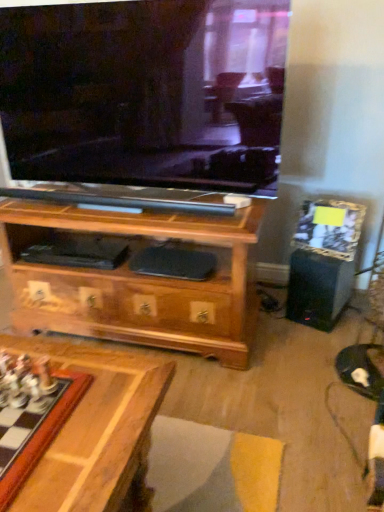
Question: Does wooden chessboard at lower left turn towards black plastic speaker at right?

Choices:
 (A) yes
 (B) no

Answer: (B)

Question: Is wooden chessboard at lower left shorter than black plastic speaker at right?

Choices:
 (A) yes
 (B) no

Answer: (A)

Question: Is wooden chessboard at lower left turned away from black plastic speaker at right?

Choices:
 (A) yes
 (B) no

Answer: (B)

Question: From the image's perspective, would you say wooden chessboard at lower left is shown under black plastic speaker at right?

Choices:
 (A) no
 (B) yes

Answer: (B)

Question: Is wooden chessboard at lower left taller than black plastic speaker at right?

Choices:
 (A) no
 (B) yes

Answer: (A)

Question: Does wooden chessboard at lower left have a lesser width compared to black plastic speaker at right?

Choices:
 (A) yes
 (B) no

Answer: (B)

Question: Is black plastic speaker at right not within wooden chessboard at lower left?

Choices:
 (A) yes
 (B) no

Answer: (A)

Question: Is black plastic speaker at right taller than wooden chessboard at lower left?

Choices:
 (A) no
 (B) yes

Answer: (B)

Question: From a real-world perspective, is black plastic speaker at right on top of wooden chessboard at lower left?

Choices:
 (A) no
 (B) yes

Answer: (A)

Question: From the image's perspective, is black plastic speaker at right below wooden chessboard at lower left?

Choices:
 (A) yes
 (B) no

Answer: (B)

Question: Is black plastic speaker at right oriented away from wooden chessboard at lower left?

Choices:
 (A) no
 (B) yes

Answer: (A)

Question: Is black plastic speaker at right thinner than wooden chessboard at lower left?

Choices:
 (A) no
 (B) yes

Answer: (B)

Question: In the image, is black plastic speaker at right on the left side or the right side of wooden chessboard at lower left?

Choices:
 (A) left
 (B) right

Answer: (B)